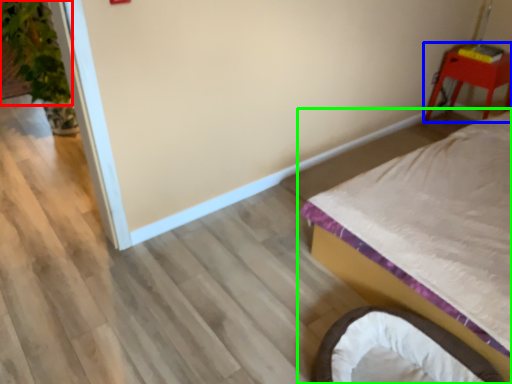
Question: Considering the real-world distances, which object is farthest from plant (highlighted by a red box)? furniture (highlighted by a blue box) or bed (highlighted by a green box)?

Choices:
 (A) furniture
 (B) bed

Answer: (A)